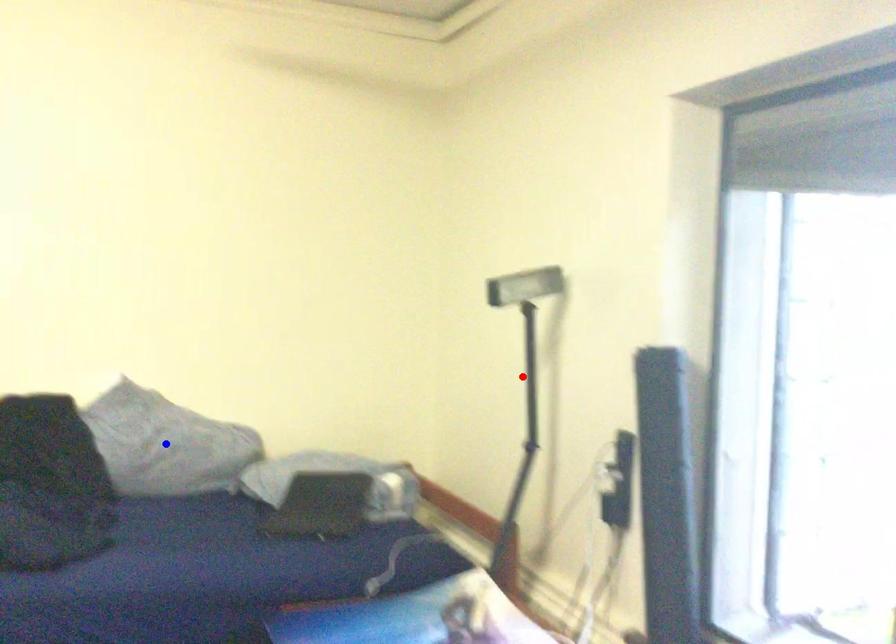
Question: Which of the two points in the image is closer to the camera?

Choices:
 (A) Blue point is closer.
 (B) Red point is closer.

Answer: (B)